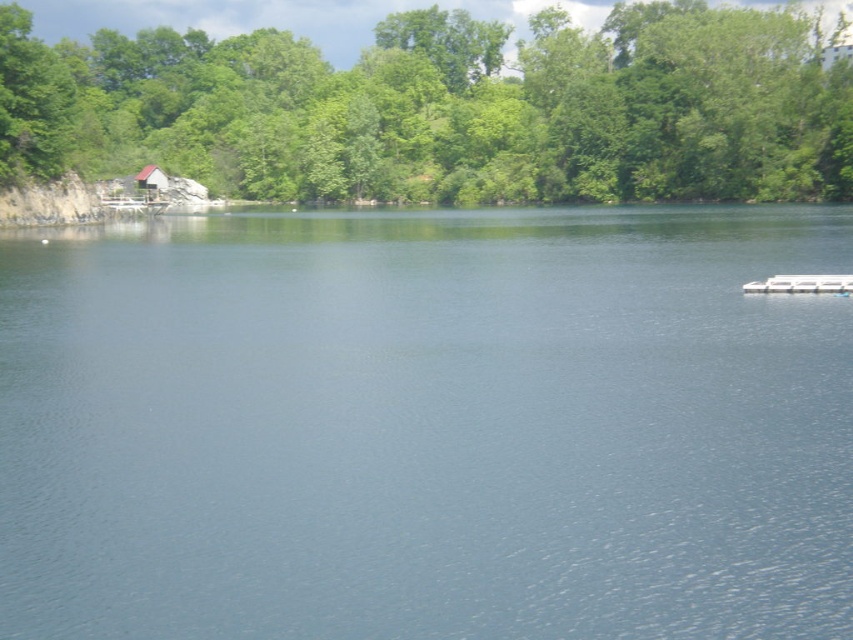
Question: Based on their relative distances, which object is nearer to the clear water at center?

Choices:
 (A) green leafy trees at upper center
 (B) brown wooden hut at upper left

Answer: (B)

Question: Which of the following is the farthest from the observer?

Choices:
 (A) clear water at center
 (B) green leafy trees at upper center
 (C) brown wooden hut at upper left

Answer: (C)

Question: Can you confirm if clear water at center is wider than green leafy trees at upper center?

Choices:
 (A) yes
 (B) no

Answer: (B)

Question: Among these points, which one is nearest to the camera?

Choices:
 (A) (631, 52)
 (B) (461, 324)
 (C) (144, 170)

Answer: (B)

Question: Is green leafy trees at upper center positioned before brown wooden hut at upper left?

Choices:
 (A) no
 (B) yes

Answer: (B)

Question: Can you confirm if clear water at center is bigger than green leafy trees at upper center?

Choices:
 (A) no
 (B) yes

Answer: (A)